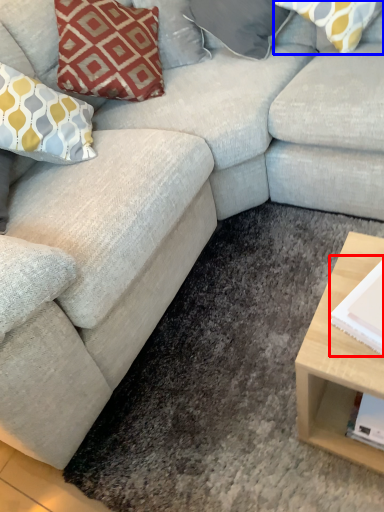
Question: Which of the following is the closest to the observer, magazine (highlighted by a red box) or pillow (highlighted by a blue box)?

Choices:
 (A) magazine
 (B) pillow

Answer: (A)